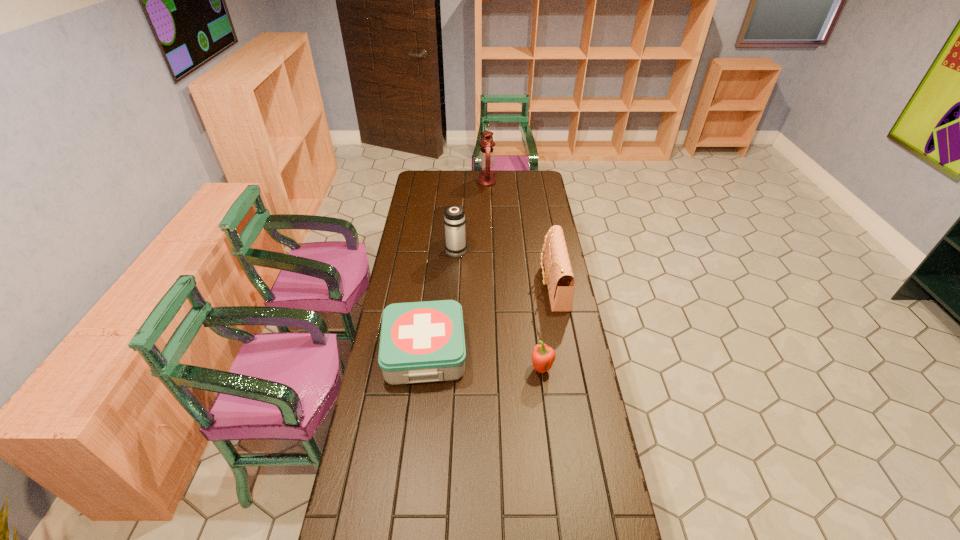
The image size is (960, 540). Find the location of `vacant space at the left edge`. vacant space at the left edge is located at coordinates (396, 428).

Where is `vacant space at the right edge of the desktop`? vacant space at the right edge of the desktop is located at coordinates (569, 460).

Where is `vacant region at the far left corner of the desktop`? The height and width of the screenshot is (540, 960). vacant region at the far left corner of the desktop is located at coordinates (431, 171).

At what (x,y) coordinates should I click in order to perform the action: click on vacant point located between the third nearest object and the pepper. Please return your answer as a coordinate pair (x, y). Image resolution: width=960 pixels, height=540 pixels. Looking at the image, I should click on (547, 327).

Locate an element on the screen. free space between the thermos bottle and the third nearest object is located at coordinates (505, 268).

The width and height of the screenshot is (960, 540). In order to click on free spot between the third object from left to right and the first-aid kit in this screenshot , I will do `click(456, 268)`.

Where is `vacant area between the handbag and the fourth nearest object`? vacant area between the handbag and the fourth nearest object is located at coordinates (505, 268).

Locate an element on the screen. Image resolution: width=960 pixels, height=540 pixels. blank region between the thermos bottle and the handbag is located at coordinates (505, 268).

The width and height of the screenshot is (960, 540). Identify the location of vacant space in between the third farthest object and the first-aid kit. (489, 319).

I want to click on vacant space that's between the pepper and the oil lamp, so click(514, 276).